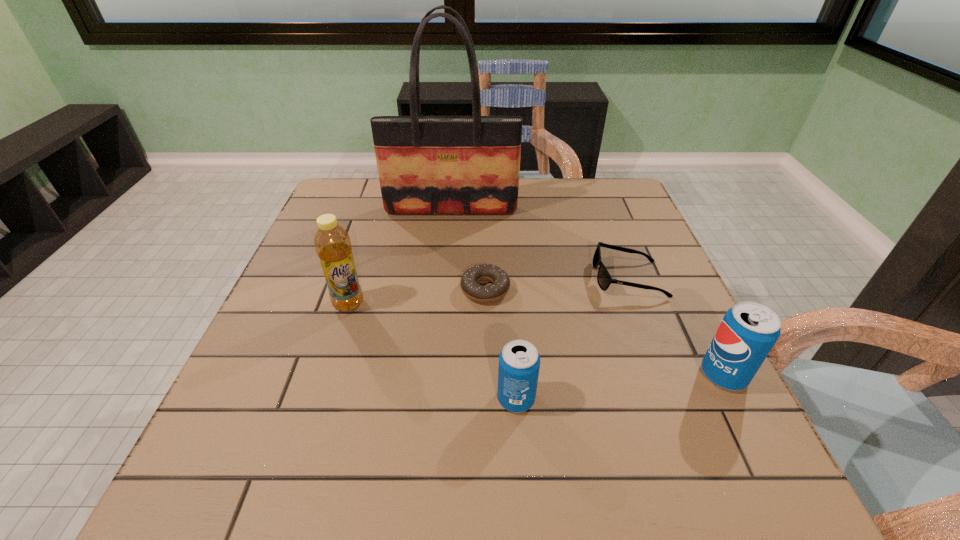
At what (x,y) coordinates should I click in order to perform the action: click on soda can that is at the right edge. Please return your answer as a coordinate pair (x, y). This screenshot has height=540, width=960. Looking at the image, I should click on (748, 331).

Find the location of a particular element. The height and width of the screenshot is (540, 960). sunglasses that is at the right edge is located at coordinates (604, 279).

In the image, there is a desktop. Where is `vacant space at the far edge`? Image resolution: width=960 pixels, height=540 pixels. vacant space at the far edge is located at coordinates (456, 215).

The width and height of the screenshot is (960, 540). I want to click on vacant space at the near edge of the desktop, so click(x=540, y=397).

Locate an element on the screen. free location at the left edge is located at coordinates (304, 393).

This screenshot has width=960, height=540. What are the coordinates of `vacant area at the right edge` in the screenshot? It's located at (623, 267).

I want to click on free space at the far left corner, so click(352, 202).

Find the location of a particular element. The image size is (960, 540). free space at the near left corner is located at coordinates (312, 399).

Find the location of a particular element. free spot at the near right corner of the desktop is located at coordinates (666, 410).

This screenshot has width=960, height=540. I want to click on free space that is in between the shorter soda can and the tallest object, so click(x=484, y=305).